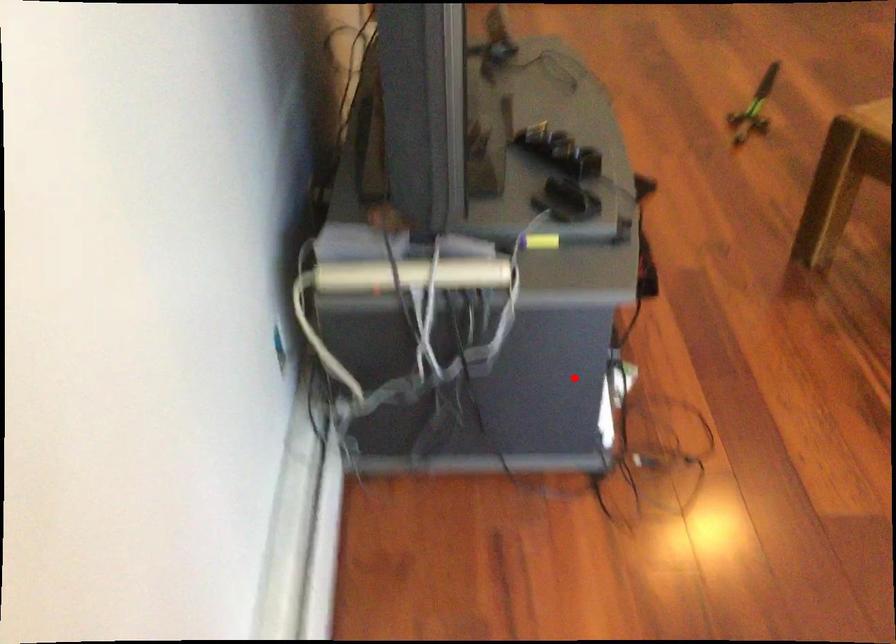
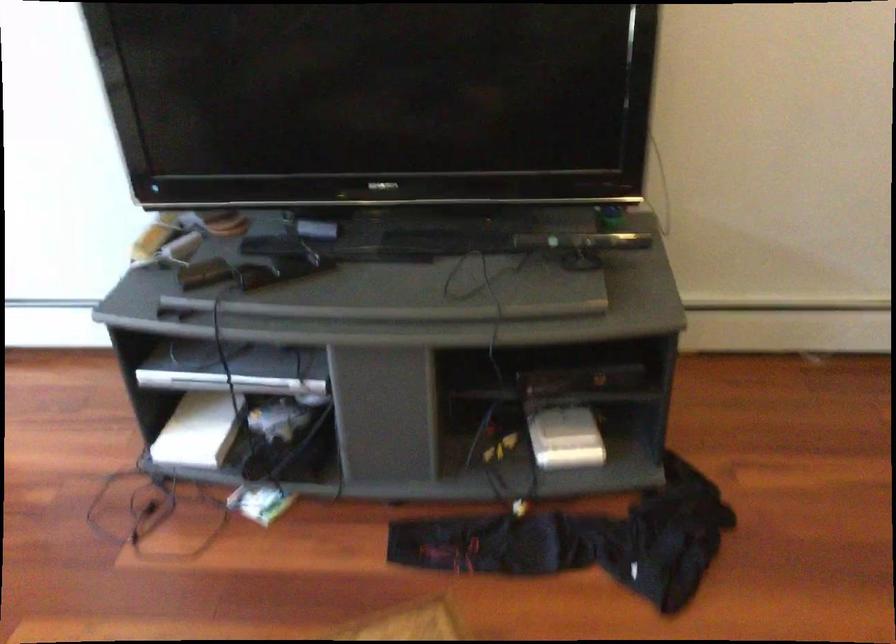
The point at the highlighted location is marked in the first image. Where is the corresponding point in the second image?

(199, 430)